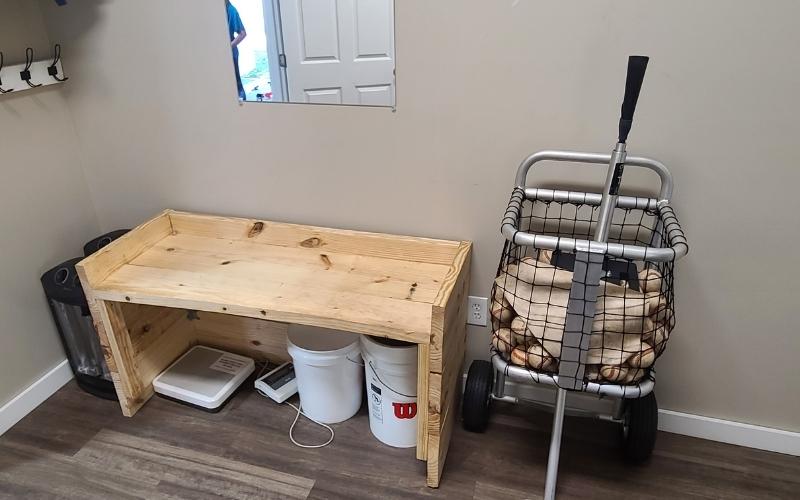
Find the location of a particular element. This screenshot has width=800, height=500. hanger is located at coordinates (37, 78).